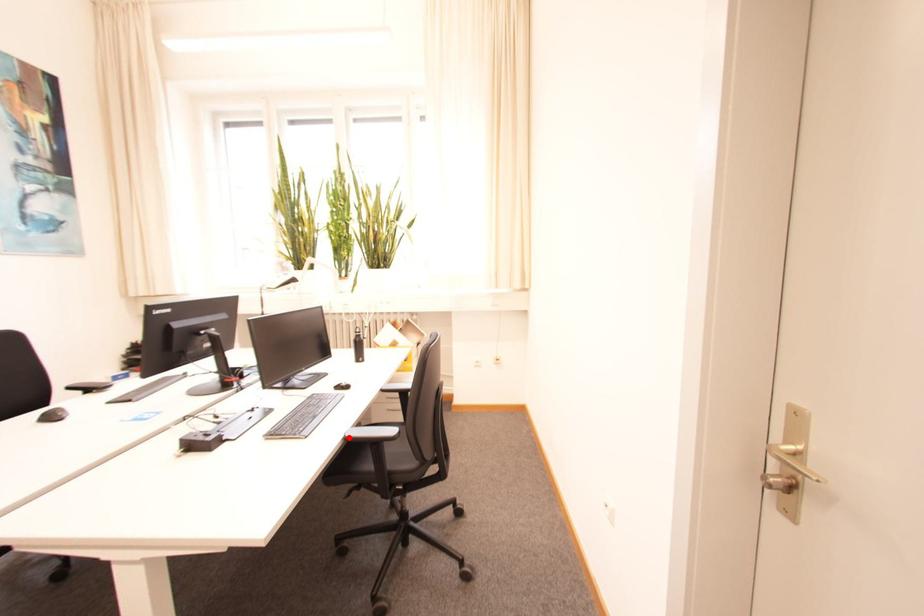
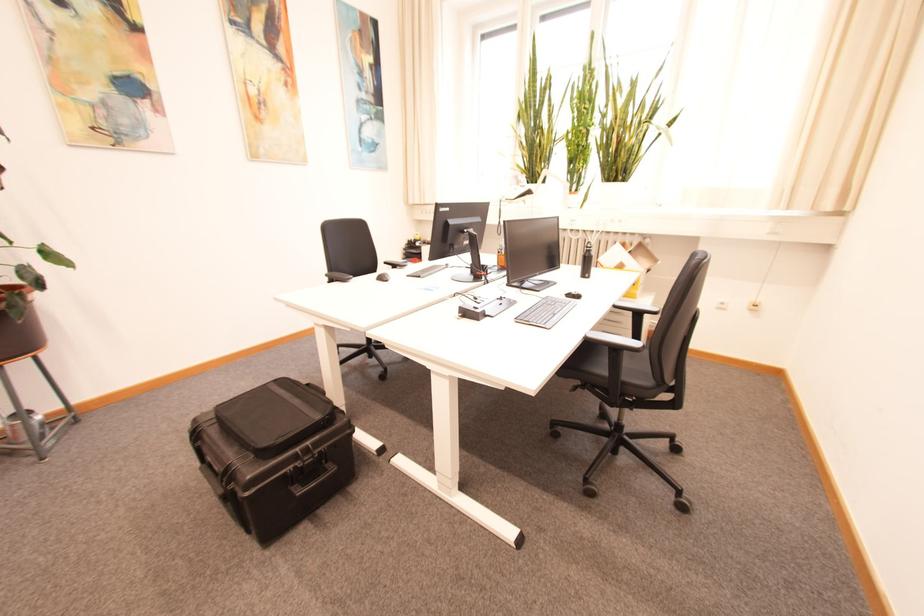
Where in the second image is the point corresponding to the highlighted location from the first image?

(590, 337)